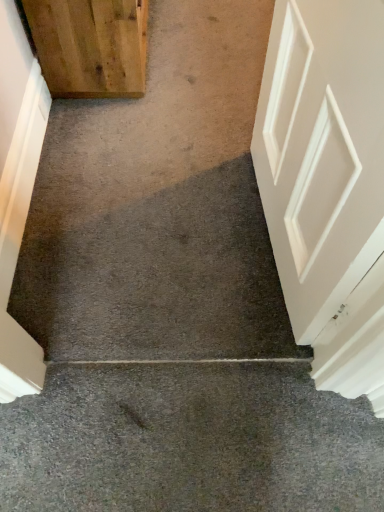
Question: Does gray carpet at center touch white matte door at left, positioned as the first door in bottom-to-top order?

Choices:
 (A) yes
 (B) no

Answer: (B)

Question: Is white matte door at left, positioned as the first door in bottom-to-top order, located within gray carpet at center?

Choices:
 (A) no
 (B) yes

Answer: (A)

Question: Is gray carpet at center turned away from white matte door at left, positioned as the first door in bottom-to-top order?

Choices:
 (A) yes
 (B) no

Answer: (B)

Question: Is gray carpet at center in front of white matte door at left, the second door in the top-to-bottom sequence?

Choices:
 (A) yes
 (B) no

Answer: (A)

Question: Is gray carpet at center positioned behind white matte door at left, the second door in the top-to-bottom sequence?

Choices:
 (A) no
 (B) yes

Answer: (A)

Question: Is white matte door at left, the second door in the top-to-bottom sequence, spatially inside gray carpet at center, or outside of it?

Choices:
 (A) outside
 (B) inside

Answer: (A)

Question: Considering the positions of point (13, 252) and point (140, 497), is point (13, 252) closer or farther from the camera than point (140, 497)?

Choices:
 (A) closer
 (B) farther

Answer: (B)

Question: From a real-world perspective, relative to gray carpet at center, is white matte door at left, positioned as the first door in bottom-to-top order, vertically above or below?

Choices:
 (A) below
 (B) above

Answer: (B)

Question: From the image's perspective, is white matte door at left, the second door in the top-to-bottom sequence, located above or below gray carpet at center?

Choices:
 (A) above
 (B) below

Answer: (A)

Question: Considering their positions, is gray carpet at center located in front of or behind wooden door at upper left, which appears as the first door when viewed from the top?

Choices:
 (A) front
 (B) behind

Answer: (A)

Question: Is gray carpet at center inside the boundaries of wooden door at upper left, the second door positioned from the bottom, or outside?

Choices:
 (A) outside
 (B) inside

Answer: (A)

Question: Considering the positions of gray carpet at center and wooden door at upper left, which appears as the first door when viewed from the top, in the image, is gray carpet at center wider or thinner than wooden door at upper left, which appears as the first door when viewed from the top,?

Choices:
 (A) wide
 (B) thin

Answer: (B)

Question: Considering the positions of gray carpet at center and wooden door at upper left, the second door positioned from the bottom, in the image, is gray carpet at center taller or shorter than wooden door at upper left, the second door positioned from the bottom,?

Choices:
 (A) short
 (B) tall

Answer: (A)

Question: From the image's perspective, relative to wooden door at upper left, which appears as the first door when viewed from the top, is white matte door at left, the second door in the top-to-bottom sequence, above or below?

Choices:
 (A) below
 (B) above

Answer: (A)

Question: Is white matte door at left, positioned as the first door in bottom-to-top order, to the left or to the right of wooden door at upper left, which appears as the first door when viewed from the top, in the image?

Choices:
 (A) left
 (B) right

Answer: (A)